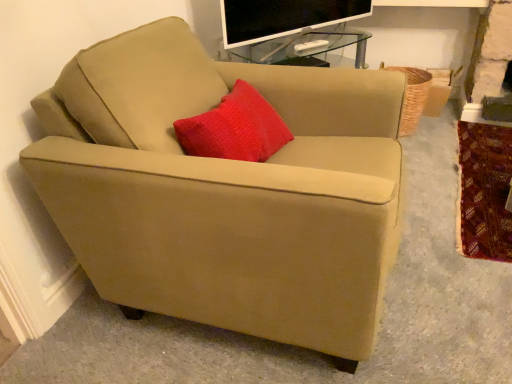
Question: Is suede beige armchair at center oriented towards flat-screen tv at upper center?

Choices:
 (A) no
 (B) yes

Answer: (A)

Question: Can you confirm if suede beige armchair at center is taller than flat-screen tv at upper center?

Choices:
 (A) yes
 (B) no

Answer: (A)

Question: Considering the relative sizes of suede beige armchair at center and flat-screen tv at upper center in the image provided, is suede beige armchair at center smaller than flat-screen tv at upper center?

Choices:
 (A) no
 (B) yes

Answer: (A)

Question: From a real-world perspective, is suede beige armchair at center over flat-screen tv at upper center?

Choices:
 (A) yes
 (B) no

Answer: (B)

Question: From a real-world perspective, does suede beige armchair at center sit lower than flat-screen tv at upper center?

Choices:
 (A) yes
 (B) no

Answer: (A)

Question: Can you confirm if suede beige armchair at center is positioned to the right of flat-screen tv at upper center?

Choices:
 (A) yes
 (B) no

Answer: (B)

Question: Considering the relative sizes of suede beige armchair at center and velvet-like red blanket at lower right in the image provided, is suede beige armchair at center taller than velvet-like red blanket at lower right?

Choices:
 (A) yes
 (B) no

Answer: (A)

Question: Is suede beige armchair at center oriented towards velvet-like red blanket at lower right?

Choices:
 (A) no
 (B) yes

Answer: (A)

Question: Is suede beige armchair at center wider than velvet-like red blanket at lower right?

Choices:
 (A) yes
 (B) no

Answer: (B)

Question: Is velvet-like red blanket at lower right surrounded by suede beige armchair at center?

Choices:
 (A) no
 (B) yes

Answer: (A)

Question: From the image's perspective, does suede beige armchair at center appear lower than velvet-like red blanket at lower right?

Choices:
 (A) yes
 (B) no

Answer: (B)

Question: Is suede beige armchair at center beside velvet-like red blanket at lower right?

Choices:
 (A) no
 (B) yes

Answer: (A)

Question: From the image's perspective, is velvet-like red blanket at lower right under woven brown basket at right?

Choices:
 (A) no
 (B) yes

Answer: (B)